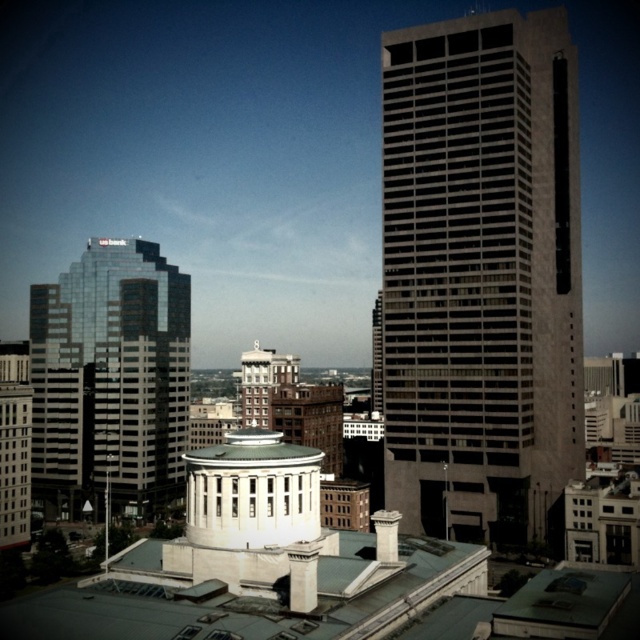
You are a city planner analyzing the skyline. Which of the two skyscrapers, the gray concrete skyscraper at center or the reflective glass skyscraper at left, has a greater width?

The gray concrete skyscraper at center has a greater width than the reflective glass skyscraper at left.

You are a city planner reviewing this area. You need to determine if the gray concrete skyscraper at center can be seen from the reflective glass skyscraper at left. Based on their positions, what do you conclude?

The gray concrete skyscraper at center is positioned over the reflective glass skyscraper at left, meaning it is in front of or above it. Therefore, the reflective glass skyscraper at left might be partially or fully obscured by the gray concrete skyscraper at center, making it difficult to see the gray concrete skyscraper from there.

You are a city planner assessing the spacing between two skyscrapers for a new project. The city requires a minimum distance of 80 meters between buildings for safety. Based on the image, can you confirm if the gray concrete skyscraper at center and the reflective glass skyscraper at left meet this requirement?

The gray concrete skyscraper at center and the reflective glass skyscraper at left are 85.26 meters apart, which exceeds the required 80 meters, so they meet the safety requirement.